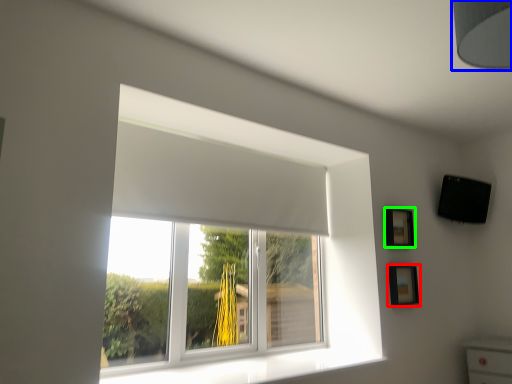
Question: Which is farther away from picture frame (highlighted by a red box)? lamp (highlighted by a blue box) or picture frame (highlighted by a green box)?

Choices:
 (A) lamp
 (B) picture frame

Answer: (A)